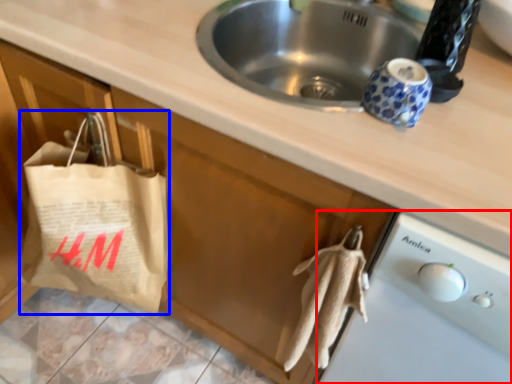
Question: Among these objects, which one is nearest to the camera, dish washer (highlighted by a red box) or grocery bag (highlighted by a blue box)?

Choices:
 (A) dish washer
 (B) grocery bag

Answer: (A)